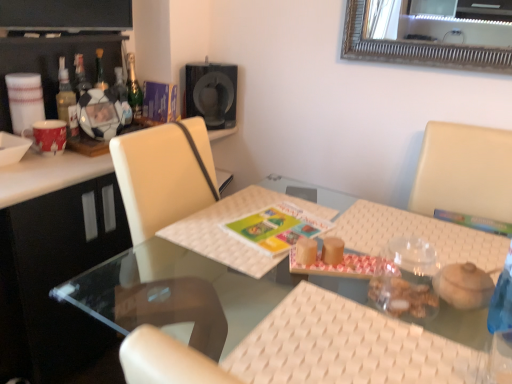
Identify the location of empty space that is ontop of clear glass table at center (from a real-world perspective). (321, 270).